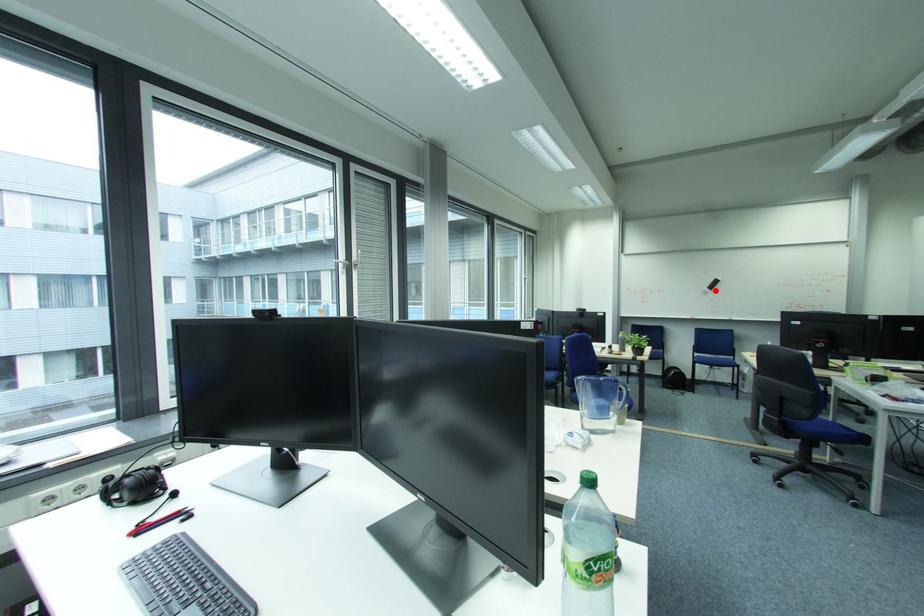
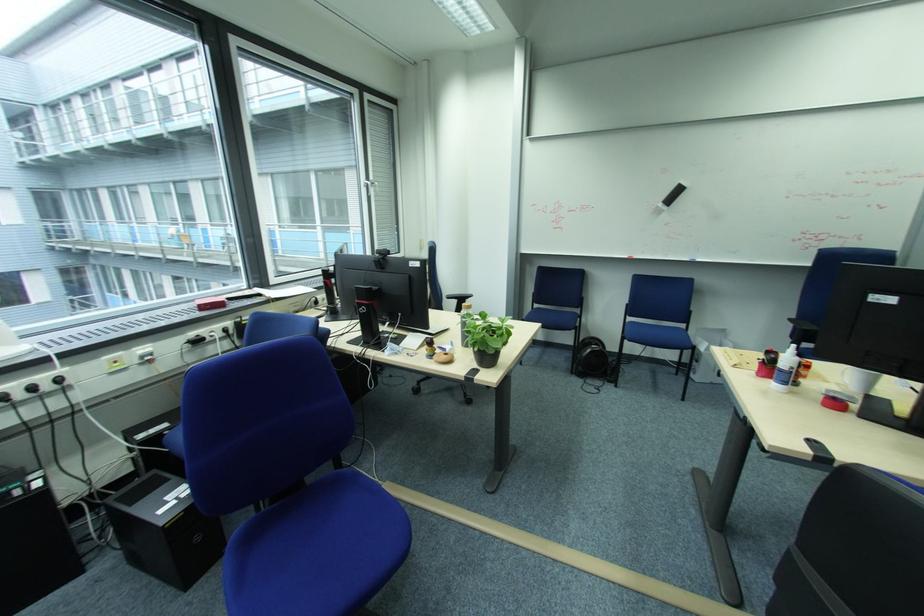
Find the pixel in the second image that matches the highlighted location in the first image.

(669, 206)